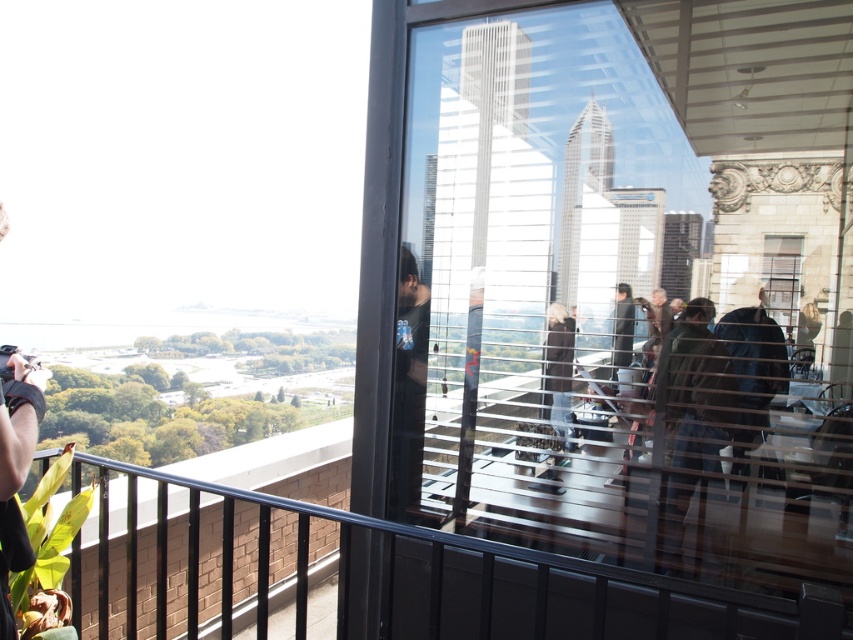
Between transparent glass window at center and dark blue jacket at right, which one has more height?

transparent glass window at center is taller.

Who is more distant from viewer, (669, 401) or (730, 339)?

The point (669, 401) is behind.

The height and width of the screenshot is (640, 853). Identify the location of transparent glass window at center. (610, 312).

What do you see at coordinates (408, 387) in the screenshot? I see `black t-shirt at center` at bounding box center [408, 387].

Based on the photo, can you confirm if black t-shirt at center is bigger than dark blue jacket at right?

Incorrect, black t-shirt at center is not larger than dark blue jacket at right.

Locate an element on the screen. black t-shirt at center is located at coordinates click(x=408, y=387).

Looking at this image, is black metal balustrade at lower left smaller than dark brown leather jacket at center?

No.

Looking at this image, between black metal balustrade at lower left and dark brown leather jacket at center, which one has more height?

black metal balustrade at lower left is taller.

Identify the location of black metal balustrade at lower left. (393, 579).